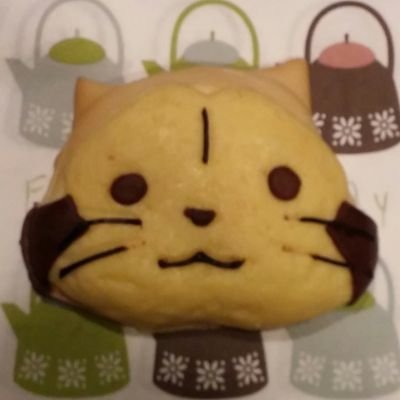
Locate an element on the screen. This screenshot has height=400, width=400. kettle is located at coordinates (346, 98), (60, 85), (208, 52), (87, 354), (224, 342), (338, 327).